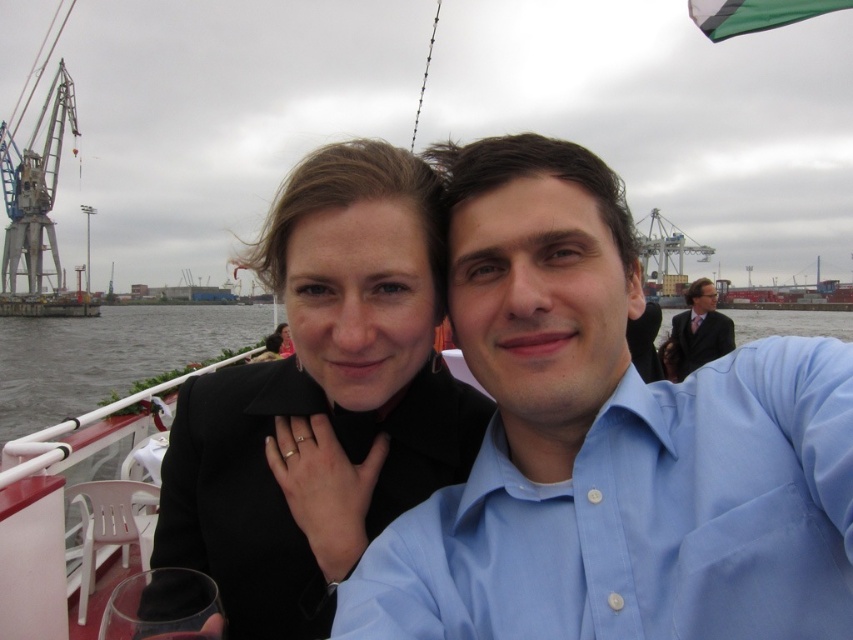
Question: Is black matte jacket at center wider than dark suit at center?

Choices:
 (A) yes
 (B) no

Answer: (A)

Question: Which of these objects is positioned closest to the dark suit at center?

Choices:
 (A) black matte jacket at center
 (B) light blue cotton shirt at upper right

Answer: (B)

Question: In this image, where is light blue cotton shirt at upper right located relative to dark suit at center?

Choices:
 (A) right
 (B) left

Answer: (B)

Question: Which of the following is the closest to the observer?

Choices:
 (A) 444,531
 (B) 323,224
 (C) 677,346

Answer: (A)

Question: Which object is positioned closest to the light blue cotton shirt at upper right?

Choices:
 (A) black matte jacket at center
 (B) dark suit at center

Answer: (A)

Question: Does light blue cotton shirt at upper right have a lesser width compared to black matte jacket at center?

Choices:
 (A) yes
 (B) no

Answer: (B)